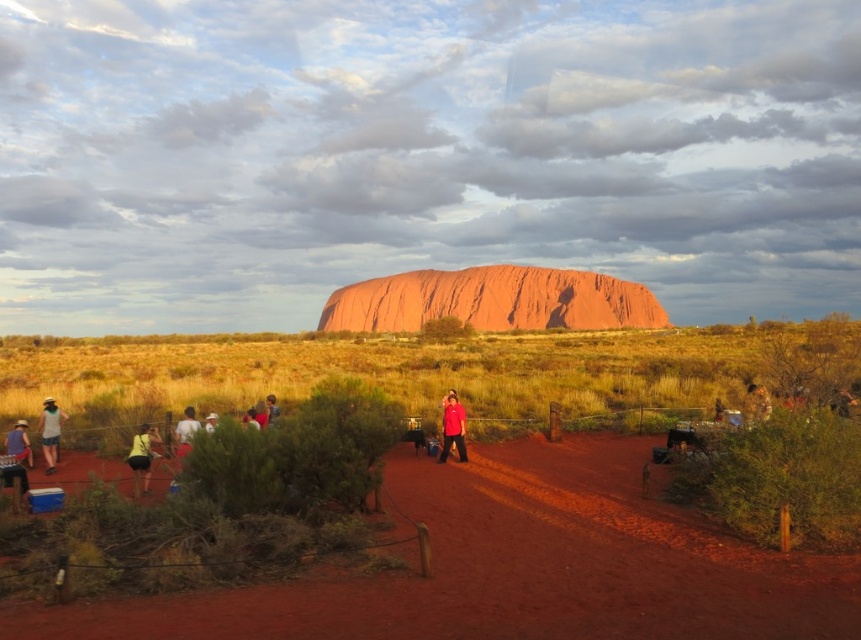
In the scene shown: You are a tourist standing at the base of Uluru. You notice the smooth sandstone rock at center and the light brown fabric shirt at lower left. Which object is higher from your viewpoint?

The smooth sandstone rock at center is located above the light brown fabric shirt at lower left, so it is higher from your viewpoint.

You are a photographer trying to capture both the matte red shirt at center and the matte white shirt at left in a single frame. Since you want to emphasize the size difference between them, which shirt should you position closer to the camera?

To emphasize the size difference between the matte red shirt at center and the matte white shirt at left, you should position the matte white shirt at left closer to the camera. Since the matte red shirt at center is already larger in size, placing the smaller matte white shirt at left nearer will make its apparent size closer to the larger one, creating a more noticeable contrast in their sizes within the frame.